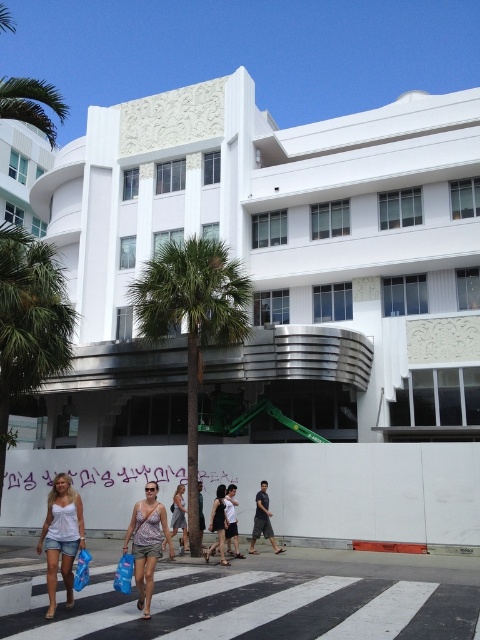
You are a delivery person standing at the entrance of the white Art Deco building. You need to place a package in one of the blue fabric bags. The package is 65 centimeters long. Can you fit the package into the space between the blue fabric bag at lower center and the blue fabric shopping bag at lower left?

The distance between the blue fabric bag at lower center and the blue fabric shopping bag at lower left is 64.31 centimeters, which is slightly shorter than the package length of 65 centimeters. Therefore, the package cannot fit between them.

You are a fashion photographer who wants to take a photo of the black dress at center. You have a camera that requires a minimum distance of 50 feet to avoid distortion. Based on the scene description, can you take the photo without distortion?

The black dress at center and camera are 49.14 feet apart. Since the required minimum distance is 50 feet, the camera is too close to the black dress at center to avoid distortion. Therefore, you cannot take the photo without distortion.

You are a pedestrian standing on the sidewalk in front of the white Art Deco building. You see a blue fabric bag at lower center and a blue fabric shopping bag at lower left. Which one is positioned higher relative to the other?

The blue fabric bag at lower center is positioned higher than the blue fabric shopping bag at lower left.